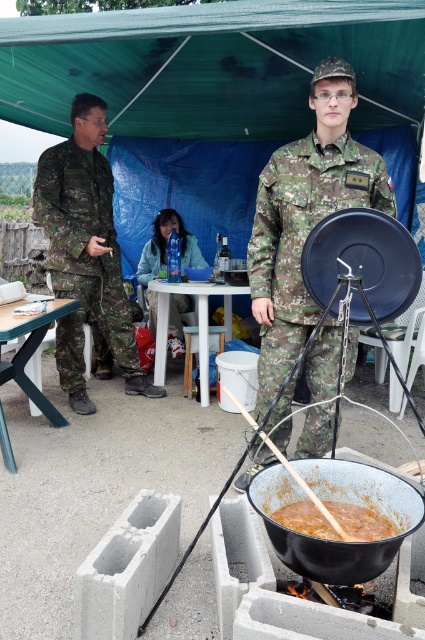
Question: Which of the following is the farthest from the observer?

Choices:
 (A) (107, 275)
 (B) (178, 330)
 (C) (289, 509)

Answer: (B)

Question: Does camouflage fabric uniform at center have a lesser width compared to white plastic picnic table at center?

Choices:
 (A) yes
 (B) no

Answer: (A)

Question: Which point is farther to the camera?

Choices:
 (A) (359, 536)
 (B) (166, 349)
 (C) (17, 353)

Answer: (B)

Question: Can you confirm if brown matte pot at center is positioned to the left of white plastic picnic table at center?

Choices:
 (A) no
 (B) yes

Answer: (A)

Question: Which point is farther to the camera?

Choices:
 (A) camouflage fabric uniform at center
 (B) white plastic picnic table at center
 (C) matte blue uniform at center
 (D) camouflage fabric uniform at left

Answer: (C)

Question: Does camouflage fabric uniform at center appear under matte blue uniform at center?

Choices:
 (A) yes
 (B) no

Answer: (A)